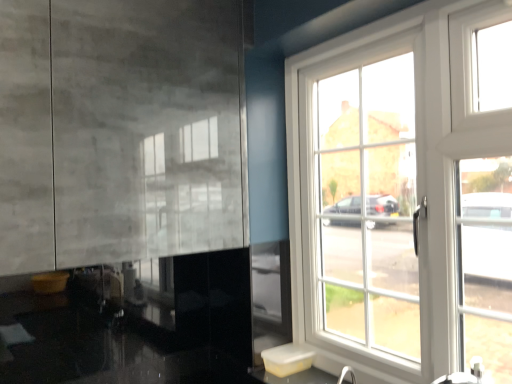
Question: Considering the positions of white glossy sink at lower right and white glass window at right in the image, is white glossy sink at lower right taller or shorter than white glass window at right?

Choices:
 (A) tall
 (B) short

Answer: (B)

Question: From a real-world perspective, is white glossy sink at lower right physically located above or below white glass window at right?

Choices:
 (A) above
 (B) below

Answer: (B)

Question: Considering the positions of point (304, 382) and point (439, 327), is point (304, 382) closer or farther from the camera than point (439, 327)?

Choices:
 (A) farther
 (B) closer

Answer: (A)

Question: From their relative heights in the image, would you say white glass window at right is taller or shorter than white glossy sink at lower right?

Choices:
 (A) tall
 (B) short

Answer: (A)

Question: Is white glass window at right wider or thinner than white glossy sink at lower right?

Choices:
 (A) thin
 (B) wide

Answer: (A)

Question: In the image, is white glass window at right on the left side or the right side of white glossy sink at lower right?

Choices:
 (A) left
 (B) right

Answer: (B)

Question: Considering the positions of white glass window at right and white glossy sink at lower right in the image, is white glass window at right bigger or smaller than white glossy sink at lower right?

Choices:
 (A) big
 (B) small

Answer: (A)